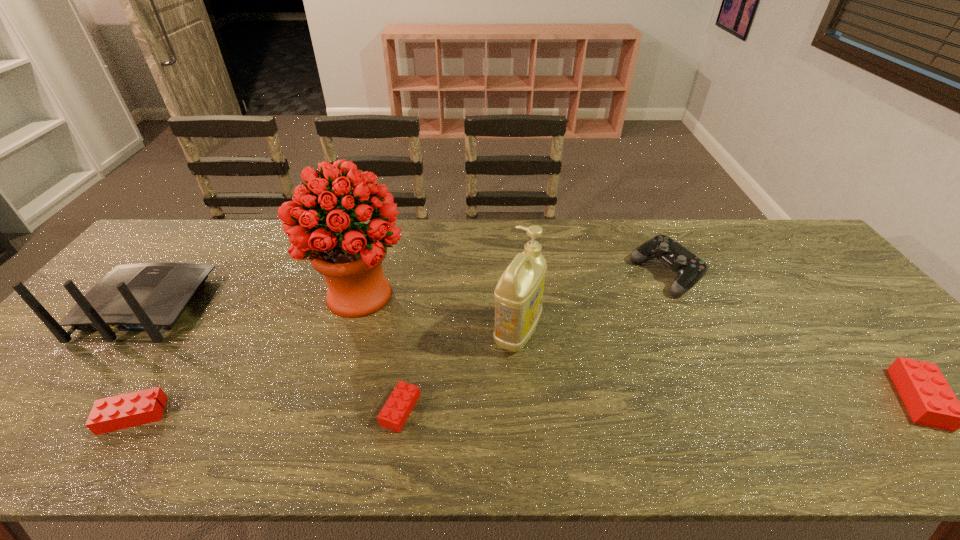
Find the location of a particular element. spot to insert another Lego for uniform distribution is located at coordinates (662, 404).